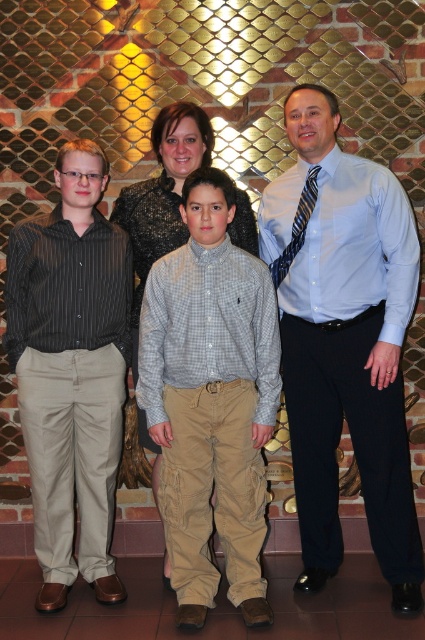
Based on the photo, which is below, striped cotton shirt at left or blue striped tie at right?

striped cotton shirt at left

Is striped cotton shirt at left positioned behind blue striped tie at right?

Yes, it is behind blue striped tie at right.

Where is `striped cotton shirt at left`? Image resolution: width=425 pixels, height=640 pixels. striped cotton shirt at left is located at coordinates (70, 371).

Between light blue shirt at center and blue striped tie at right, which one is positioned higher?

blue striped tie at right

Is light blue shirt at center thinner than blue striped tie at right?

In fact, light blue shirt at center might be wider than blue striped tie at right.

What do you see at coordinates (343, 339) in the screenshot? I see `light blue shirt at center` at bounding box center [343, 339].

Image resolution: width=425 pixels, height=640 pixels. Find the location of `light blue shirt at center`. light blue shirt at center is located at coordinates (343, 339).

Between gray checkered shirt at center and striped cotton shirt at left, which one is positioned higher?

Positioned higher is striped cotton shirt at left.

Which of these two, gray checkered shirt at center or striped cotton shirt at left, stands taller?

striped cotton shirt at left

The width and height of the screenshot is (425, 640). Find the location of `gray checkered shirt at center`. gray checkered shirt at center is located at coordinates (210, 401).

Image resolution: width=425 pixels, height=640 pixels. I want to click on gray checkered shirt at center, so click(x=210, y=401).